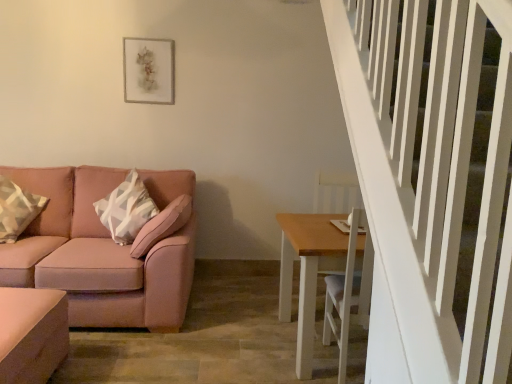
Question: Is pink fabric couch at left to the right of matte pink ottoman at lower left, the 1th table positioned from the left, from the viewer's perspective?

Choices:
 (A) no
 (B) yes

Answer: (A)

Question: Can you confirm if pink fabric couch at left is thinner than matte pink ottoman at lower left, the 1th table positioned from the left?

Choices:
 (A) yes
 (B) no

Answer: (B)

Question: Considering the relative sizes of pink fabric couch at left and matte pink ottoman at lower left, which is the second table from right to left, in the image provided, is pink fabric couch at left shorter than matte pink ottoman at lower left, which is the second table from right to left,?

Choices:
 (A) no
 (B) yes

Answer: (A)

Question: Is pink fabric couch at left not near matte pink ottoman at lower left, which is the second table from right to left?

Choices:
 (A) yes
 (B) no

Answer: (B)

Question: From a real-world perspective, is pink fabric couch at left positioned under matte pink ottoman at lower left, the 1th table positioned from the left, based on gravity?

Choices:
 (A) no
 (B) yes

Answer: (A)

Question: Is pink fabric couch at left wider than matte pink ottoman at lower left, the 1th table positioned from the left?

Choices:
 (A) no
 (B) yes

Answer: (B)

Question: Could you tell me if light brown wooden table at lower right, acting as the 1th table starting from the right, is facing pink fabric couch at left?

Choices:
 (A) yes
 (B) no

Answer: (B)

Question: Can pink fabric couch at left be found inside light brown wooden table at lower right, which is the second table from left to right?

Choices:
 (A) no
 (B) yes

Answer: (A)

Question: Can you confirm if light brown wooden table at lower right, acting as the 1th table starting from the right, is shorter than pink fabric couch at left?

Choices:
 (A) no
 (B) yes

Answer: (B)

Question: From a real-world perspective, is light brown wooden table at lower right, acting as the 1th table starting from the right, over pink fabric couch at left?

Choices:
 (A) no
 (B) yes

Answer: (A)

Question: From a real-world perspective, is light brown wooden table at lower right, which is the second table from left to right, under pink fabric couch at left?

Choices:
 (A) yes
 (B) no

Answer: (A)

Question: Does matte gray picture frame at upper center have a lesser height compared to light brown wooden table at lower right, which is the second table from left to right?

Choices:
 (A) yes
 (B) no

Answer: (A)